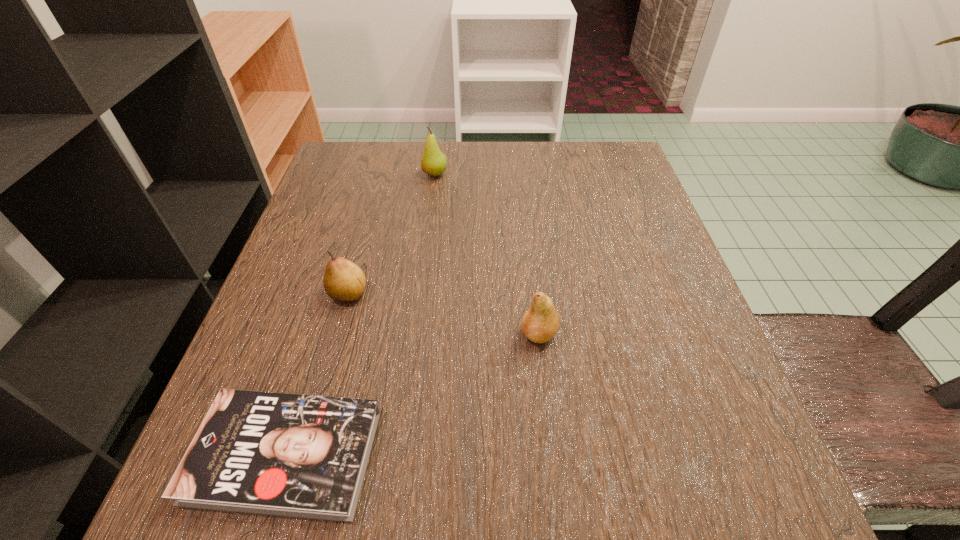
The width and height of the screenshot is (960, 540). In order to click on vacant space at the far right corner of the desktop in this screenshot , I will do `click(632, 165)`.

Where is `free space at the near right corner`? This screenshot has height=540, width=960. free space at the near right corner is located at coordinates (715, 494).

The image size is (960, 540). I want to click on vacant region between the farthest object and the second nearest pear, so click(392, 234).

Locate an element on the screen. The image size is (960, 540). empty location between the second object from right to left and the rightmost pear is located at coordinates pos(487,254).

Identify the location of free space between the rightmost pear and the second farthest object. This screenshot has height=540, width=960. (444, 313).

Locate an element on the screen. free point between the book and the second object from right to left is located at coordinates (360, 315).

Locate an element on the screen. vacant space in between the rightmost pear and the third object from left to right is located at coordinates (487, 254).

At what (x,y) coordinates should I click in order to perform the action: click on free space between the nearest object and the rightmost pear. Please return your answer as a coordinate pair (x, y). The width and height of the screenshot is (960, 540). Looking at the image, I should click on (412, 394).

Find the location of `free space between the farthest pear and the rightmost pear`. free space between the farthest pear and the rightmost pear is located at coordinates (487, 254).

This screenshot has height=540, width=960. Identify the location of unoccupied area between the second pear from right to left and the nearest pear. (487, 254).